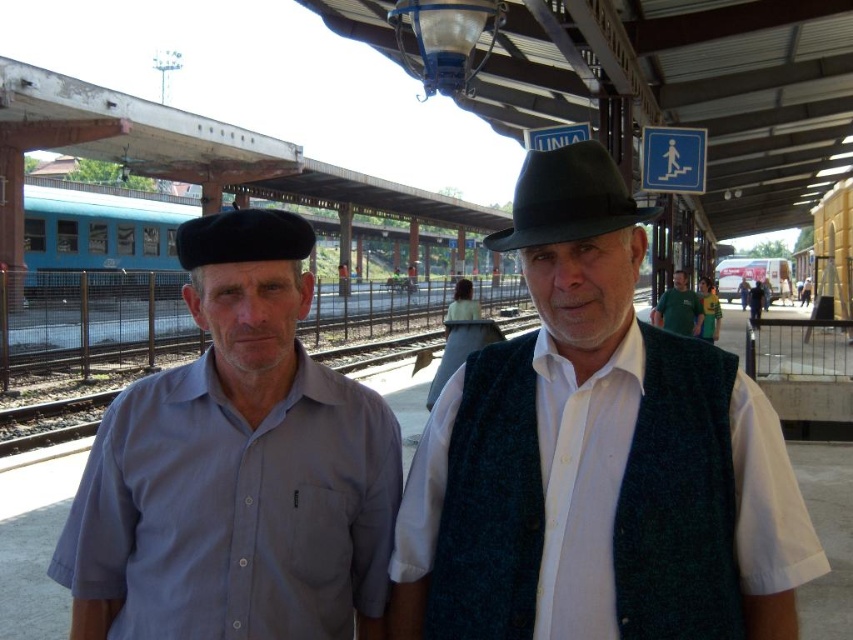
Consider the image. You are standing at the train station and want to reach a specific point marked at coordinates point (161, 572). If your current position is 5 feet away from the camera, can you walk straight ahead to reach it without needing to adjust your path?

The distance of point (161, 572) from camera is 7.87 feet. Since you are currently 5 feet away from the camera, walking straight ahead will get you to the point as it is further away from the camera than your current position.

You are a photographer positioned on the train station platform. You need to capture a photo that includes both the light blue cotton shirt at left and the black felt beret at left. Considering their height difference, which object should you focus on to ensure both are in frame?

The light blue cotton shirt at left is much taller than the black felt beret at left, so focusing on the light blue cotton shirt at left will help ensure both are visible in the photo.